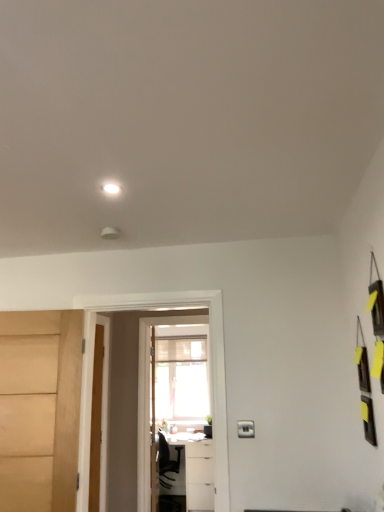
Question: Considering the relative sizes of wooden door at center, arranged as the second door when viewed from the back, and transparent glass screen door at center in the image provided, is wooden door at center, arranged as the second door when viewed from the back, smaller than transparent glass screen door at center?

Choices:
 (A) yes
 (B) no

Answer: (B)

Question: From the image's perspective, is wooden door at center, the 2th door positioned from the left, on transparent glass screen door at center?

Choices:
 (A) yes
 (B) no

Answer: (A)

Question: Is wooden door at center, the second door when ordered from right to left, far away from transparent glass screen door at center?

Choices:
 (A) yes
 (B) no

Answer: (A)

Question: Is wooden door at center, the 2th door in the front-to-back sequence, next to transparent glass screen door at center?

Choices:
 (A) yes
 (B) no

Answer: (B)

Question: From a real-world perspective, is wooden door at center, the 2th door in the front-to-back sequence, positioned over transparent glass screen door at center based on gravity?

Choices:
 (A) no
 (B) yes

Answer: (A)

Question: Is white glossy table at lower center inside or outside of transparent glass screen door at center?

Choices:
 (A) inside
 (B) outside

Answer: (B)

Question: In terms of width, does white glossy table at lower center look wider or thinner when compared to transparent glass screen door at center?

Choices:
 (A) thin
 (B) wide

Answer: (B)

Question: From the image's perspective, relative to transparent glass screen door at center, is white glossy table at lower center above or below?

Choices:
 (A) below
 (B) above

Answer: (A)

Question: From their relative heights in the image, would you say white glossy table at lower center is taller or shorter than transparent glass screen door at center?

Choices:
 (A) tall
 (B) short

Answer: (B)

Question: From their relative heights in the image, would you say white glossy light at upper center is taller or shorter than white glossy table at lower center?

Choices:
 (A) tall
 (B) short

Answer: (B)

Question: Looking at the image, does white glossy light at upper center seem bigger or smaller compared to white glossy table at lower center?

Choices:
 (A) small
 (B) big

Answer: (A)

Question: In terms of width, does white glossy light at upper center look wider or thinner when compared to white glossy table at lower center?

Choices:
 (A) wide
 (B) thin

Answer: (B)

Question: Is white glossy light at upper center in front of or behind white glossy table at lower center in the image?

Choices:
 (A) behind
 (B) front

Answer: (B)

Question: Is wooden door at center, the second door when ordered from right to left, taller or shorter than white glossy table at lower center?

Choices:
 (A) tall
 (B) short

Answer: (A)

Question: Is point (99, 451) positioned closer to the camera than point (190, 496)?

Choices:
 (A) closer
 (B) farther

Answer: (A)